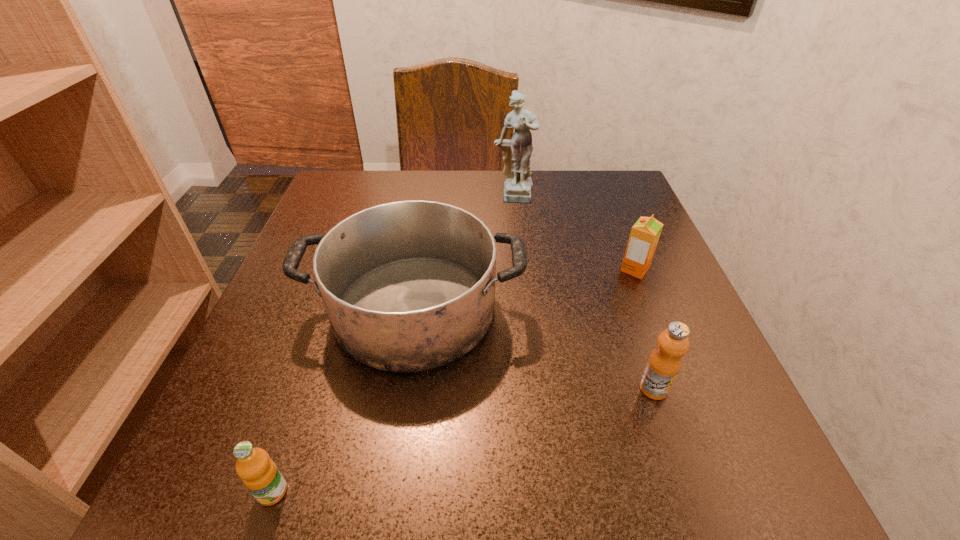
The width and height of the screenshot is (960, 540). What are the coordinates of `vacant point located on the front of the farthest orange juice` in the screenshot? It's located at (646, 299).

The image size is (960, 540). I want to click on object situated at the far edge, so click(x=517, y=188).

Identify the location of object that is at the near edge. (259, 473).

The width and height of the screenshot is (960, 540). I want to click on saucepan positioned at the left edge, so click(408, 286).

Where is `orange juice that is at the left edge`? orange juice that is at the left edge is located at coordinates (259, 473).

I want to click on object positioned at the near left corner, so click(259, 473).

This screenshot has width=960, height=540. Identify the location of free space at the far edge of the desktop. (546, 219).

In the image, there is a desktop. Identify the location of vacant space at the near edge. The width and height of the screenshot is (960, 540). (366, 474).

This screenshot has width=960, height=540. I want to click on free space at the right edge of the desktop, so click(x=685, y=294).

I want to click on vacant space at the far left corner of the desktop, so click(348, 212).